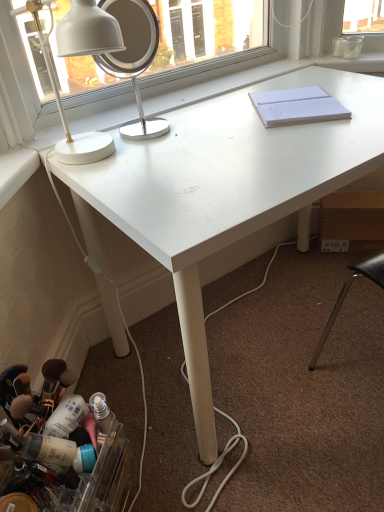
This screenshot has height=512, width=384. I want to click on vacant space in white matte desk at center (from a real-world perspective), so click(x=265, y=325).